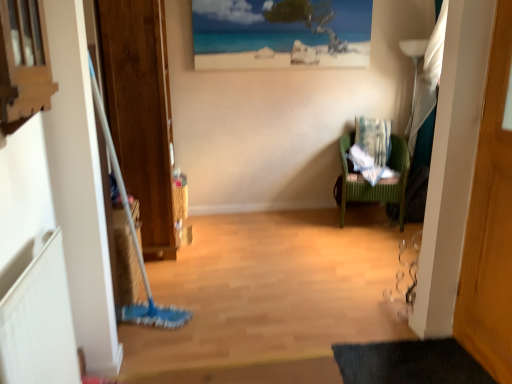
Question: Could you tell me if patterned fabric laundry at right is turned towards wooden door at right?

Choices:
 (A) yes
 (B) no

Answer: (A)

Question: From a real-world perspective, is patterned fabric laundry at right physically below wooden door at right?

Choices:
 (A) yes
 (B) no

Answer: (A)

Question: Considering the relative sizes of patterned fabric laundry at right and wooden door at right in the image provided, is patterned fabric laundry at right wider than wooden door at right?

Choices:
 (A) yes
 (B) no

Answer: (A)

Question: Can you confirm if patterned fabric laundry at right is smaller than wooden door at right?

Choices:
 (A) yes
 (B) no

Answer: (A)

Question: From a real-world perspective, is patterned fabric laundry at right over wooden door at right?

Choices:
 (A) no
 (B) yes

Answer: (A)

Question: From the image's perspective, relative to wooden screen door at left, is green plastic chair at right above or below?

Choices:
 (A) below
 (B) above

Answer: (A)

Question: Is point (391, 187) positioned closer to the camera than point (104, 81)?

Choices:
 (A) farther
 (B) closer

Answer: (A)

Question: In the image, is green plastic chair at right on the left side or the right side of wooden screen door at left?

Choices:
 (A) right
 (B) left

Answer: (A)

Question: Relative to wooden screen door at left, is green plastic chair at right in front or behind?

Choices:
 (A) behind
 (B) front

Answer: (A)

Question: Based on their positions, is wooden frame at upper left located to the left or right of beach scene print at upper center?

Choices:
 (A) left
 (B) right

Answer: (A)

Question: Is wooden frame at upper left wider or thinner than beach scene print at upper center?

Choices:
 (A) wide
 (B) thin

Answer: (A)

Question: From their relative heights in the image, would you say wooden frame at upper left is taller or shorter than beach scene print at upper center?

Choices:
 (A) tall
 (B) short

Answer: (B)

Question: From the image's perspective, is wooden frame at upper left positioned above or below beach scene print at upper center?

Choices:
 (A) below
 (B) above

Answer: (A)

Question: Does point (339, 46) appear closer or farther from the camera than point (399, 213)?

Choices:
 (A) closer
 (B) farther

Answer: (B)

Question: Is beach scene print at upper center situated inside green plastic chair at right or outside?

Choices:
 (A) inside
 (B) outside

Answer: (B)